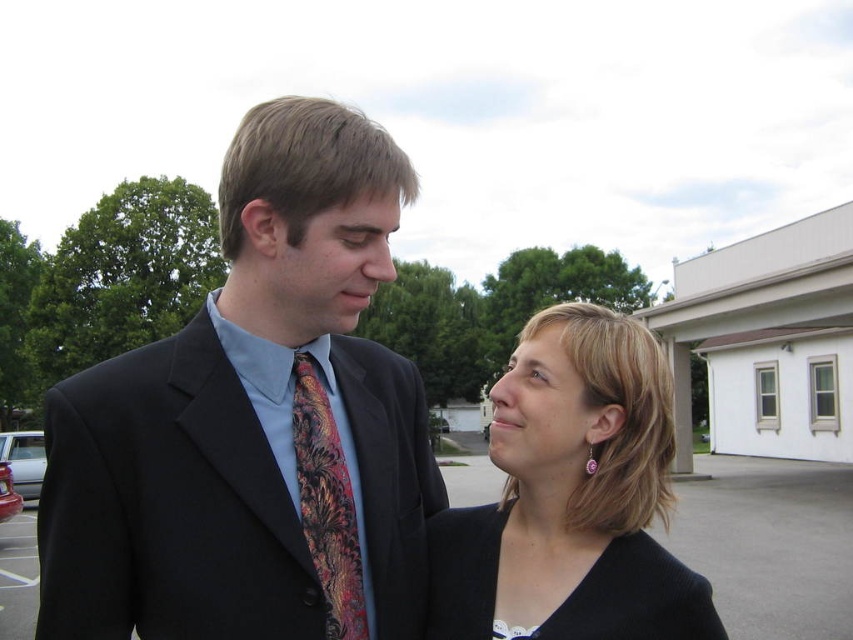
Is black fabric at center to the right of asphalt pavement at lower center from the viewer's perspective?

Incorrect, black fabric at center is not on the right side of asphalt pavement at lower center.

What do you see at coordinates (572, 497) in the screenshot? This screenshot has height=640, width=853. I see `black fabric at center` at bounding box center [572, 497].

I want to click on black fabric at center, so click(x=572, y=497).

Can you confirm if black fabric at center is positioned to the left of black knit dress at lower center?

In fact, black fabric at center is to the right of black knit dress at lower center.

Does point (651, 472) come farther from viewer compared to point (523, 630)?

That is True.

At what (x,y) coordinates should I click in order to perform the action: click on black fabric at center. Please return your answer as a coordinate pair (x, y). The image size is (853, 640). Looking at the image, I should click on (572, 497).

Is point (84, 388) less distant than point (740, 496)?

Yes, it is in front of point (740, 496).

From the picture: Who is more distant from viewer, (173, 340) or (779, 468)?

Point (779, 468)

Is point (247, 125) in front of point (758, 500)?

Yes, point (247, 125) is closer to viewer.

The height and width of the screenshot is (640, 853). Find the location of `matte black suit at center`. matte black suit at center is located at coordinates (254, 422).